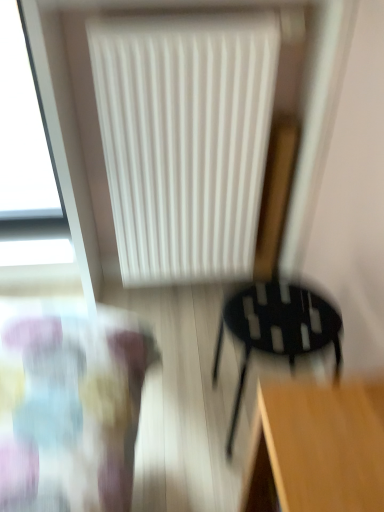
Question: Should I look upward or downward to see white matte radiator at upper center?

Choices:
 (A) up
 (B) down

Answer: (A)

Question: From the image's perspective, is white matte radiator at upper center located beneath black matte chair at lower right?

Choices:
 (A) no
 (B) yes

Answer: (A)

Question: From a real-world perspective, is white matte radiator at upper center physically above black matte chair at lower right?

Choices:
 (A) no
 (B) yes

Answer: (B)

Question: Are white matte radiator at upper center and black matte chair at lower right located far from each other?

Choices:
 (A) yes
 (B) no

Answer: (B)

Question: Would you say white matte radiator at upper center contains black matte chair at lower right?

Choices:
 (A) yes
 (B) no

Answer: (B)

Question: Does white matte radiator at upper center appear on the right side of black matte chair at lower right?

Choices:
 (A) no
 (B) yes

Answer: (A)

Question: Is white matte radiator at upper center oriented away from black matte chair at lower right?

Choices:
 (A) no
 (B) yes

Answer: (A)

Question: Is the depth of black matte chair at lower right greater than that of white matte radiator at upper center?

Choices:
 (A) no
 (B) yes

Answer: (A)

Question: Is black matte chair at lower right facing towards white matte radiator at upper center?

Choices:
 (A) no
 (B) yes

Answer: (A)

Question: Is black matte chair at lower right beside white matte radiator at upper center?

Choices:
 (A) no
 (B) yes

Answer: (A)

Question: Is black matte chair at lower right thinner than white matte radiator at upper center?

Choices:
 (A) yes
 (B) no

Answer: (B)

Question: From the image's perspective, is black matte chair at lower right on top of white matte radiator at upper center?

Choices:
 (A) no
 (B) yes

Answer: (A)

Question: From a real-world perspective, is black matte chair at lower right located beneath white matte radiator at upper center?

Choices:
 (A) no
 (B) yes

Answer: (B)

Question: Is white matte radiator at upper center to the left or to the right of black matte chair at lower right in the image?

Choices:
 (A) right
 (B) left

Answer: (B)